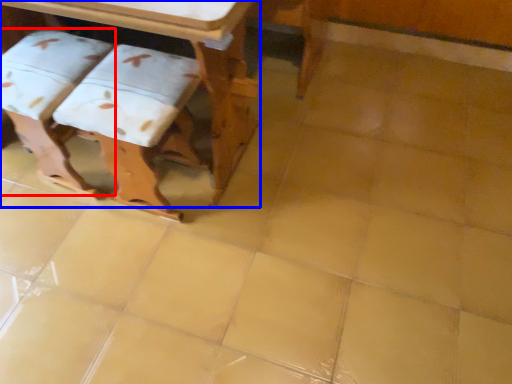
Question: Among these objects, which one is farthest to the camera, step stool (highlighted by a red box) or table (highlighted by a blue box)?

Choices:
 (A) step stool
 (B) table

Answer: (A)